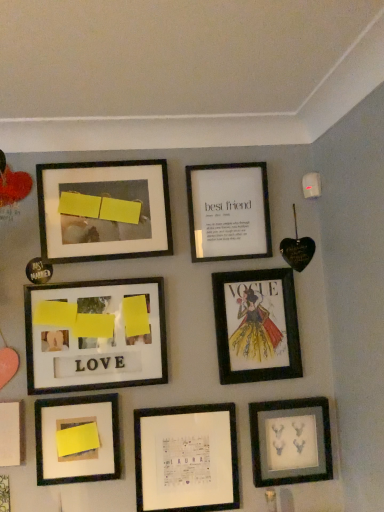
Question: Is point (54, 457) positioned closer to the camera than point (107, 173)?

Choices:
 (A) closer
 (B) farther

Answer: (A)

Question: From a real-world perspective, is matte yellow sticky note at lower left, marked as the 4th picture frame in a bottom-to-top arrangement, positioned above or below matte black frame at upper left, which appears as the eighth picture frame when ordered from the bottom?

Choices:
 (A) above
 (B) below

Answer: (B)

Question: Which object is positioned farthest from the matte black deer heads at lower right, acting as the third picture frame starting from the bottom?

Choices:
 (A) matte yellow paper at center left, placed as the sixth picture frame when sorted from bottom to top
 (B) matte black frame at upper left, arranged as the 9th picture frame when viewed from the top
 (C) matte paper vogue cover at center right, the 7th picture frame from the bottom
 (D) matte yellow sticky note at lower left, placed as the 6th picture frame when sorted from top to bottom
 (E) matte black frame at upper left, the 2th picture frame viewed from the top

Answer: (B)

Question: Based on their relative distances, which object is farther from the matte yellow sticky note at lower left, placed as the 6th picture frame when sorted from top to bottom?

Choices:
 (A) matte black frame at upper left, which appears as the eighth picture frame when ordered from the bottom
 (B) white matte paper at lower left, the 5th picture frame in the top-to-bottom sequence
 (C) matte yellow paper at center left, the 4th picture frame viewed from the top
 (D) matte black frame at upper left, which is counted as the first picture frame, starting from the bottom
 (E) matte black deer heads at lower right, which is counted as the 7th picture frame, starting from the top

Answer: (A)